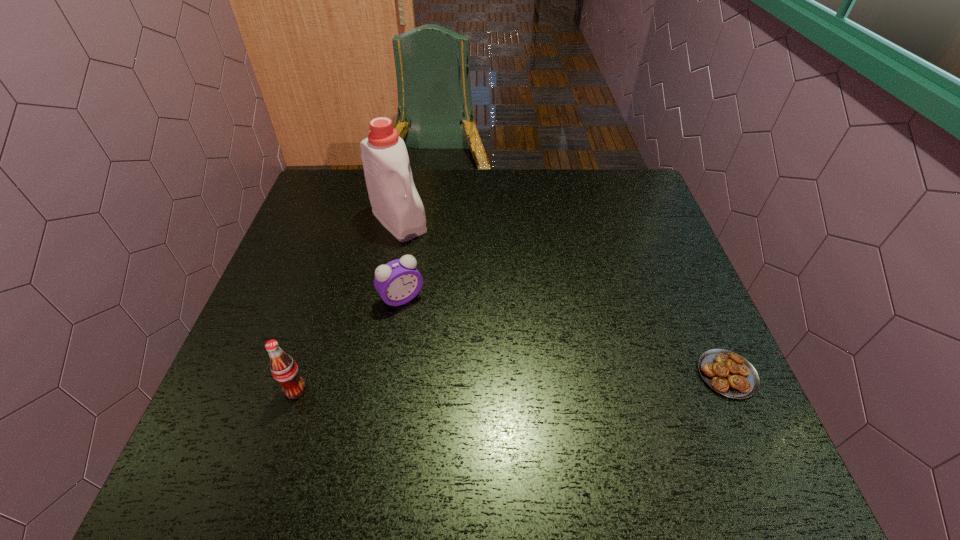
This screenshot has width=960, height=540. What are the coordinates of `vacant space in between the shortest object and the leftmost object` in the screenshot? It's located at (512, 382).

This screenshot has height=540, width=960. Find the location of `free area in between the third nearest object and the rightmost object`. free area in between the third nearest object and the rightmost object is located at coordinates (564, 336).

Locate an element on the screen. vacant area that lies between the second tallest object and the detergent is located at coordinates (348, 305).

Locate an element on the screen. This screenshot has height=540, width=960. vacant area between the soda and the second shortest object is located at coordinates (348, 343).

You are a GUI agent. You are given a task and a screenshot of the screen. Output one action in this format:
    pyautogui.click(x=<x>, y=<y>)
    Task: Click on the free area in between the soda and the detergent
    Image resolution: width=960 pixels, height=540 pixels.
    Given the screenshot: What is the action you would take?
    pyautogui.click(x=348, y=305)

At what (x,y) coordinates should I click in order to perform the action: click on vacant area that lies between the second tallest object and the rightmost object. Please return your answer as a coordinate pair (x, y). This screenshot has height=540, width=960. Looking at the image, I should click on (512, 382).

At what (x,y) coordinates should I click in order to perform the action: click on free space between the second tallest object and the farthest object. Please return your answer as a coordinate pair (x, y). Looking at the image, I should click on coord(348,305).

Image resolution: width=960 pixels, height=540 pixels. Identify the location of free point between the shortest object and the farthest object. (564, 298).

Identify the location of empty space between the farthest object and the second tallest object. (348, 305).

Identify which object is the third nearest to the second farthest object. Please provide its 2D coordinates. Your answer should be formatted as a tuple, i.e. [(x, y)], where the tuple contains the x and y coordinates of a point satisfying the conditions above.

[(728, 373)]